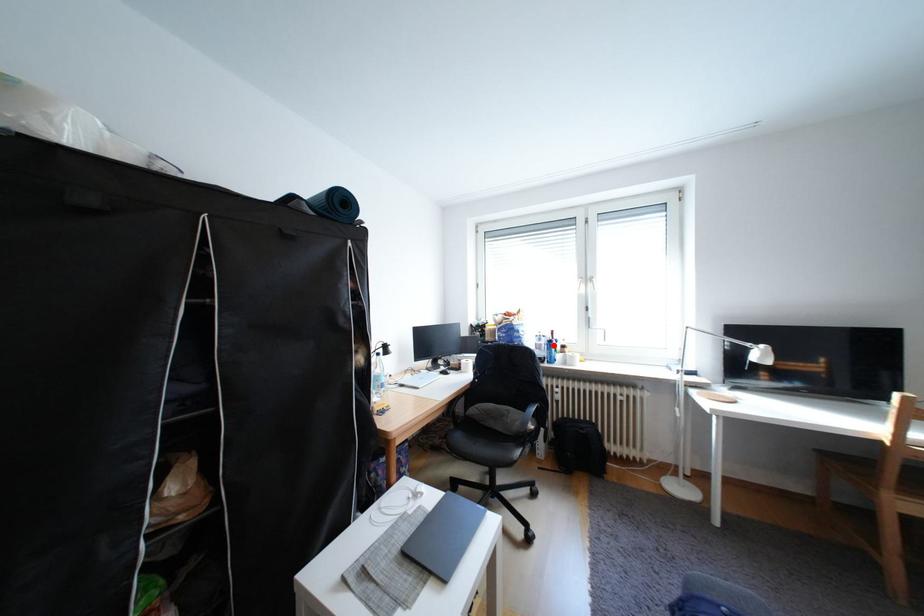
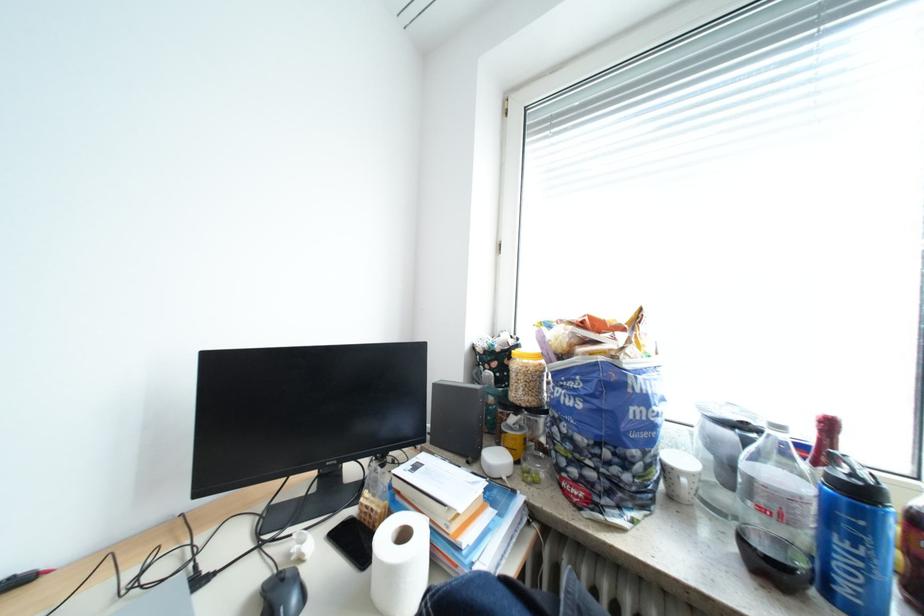
Question: I am providing you with two images of the same scene from different viewpoints. Given a red point in image1, look at the same physical point in image2. Is it:

Choices:
 (A) Closer to the viewpoint
 (B) Farther from the viewpoint

Answer: (A)